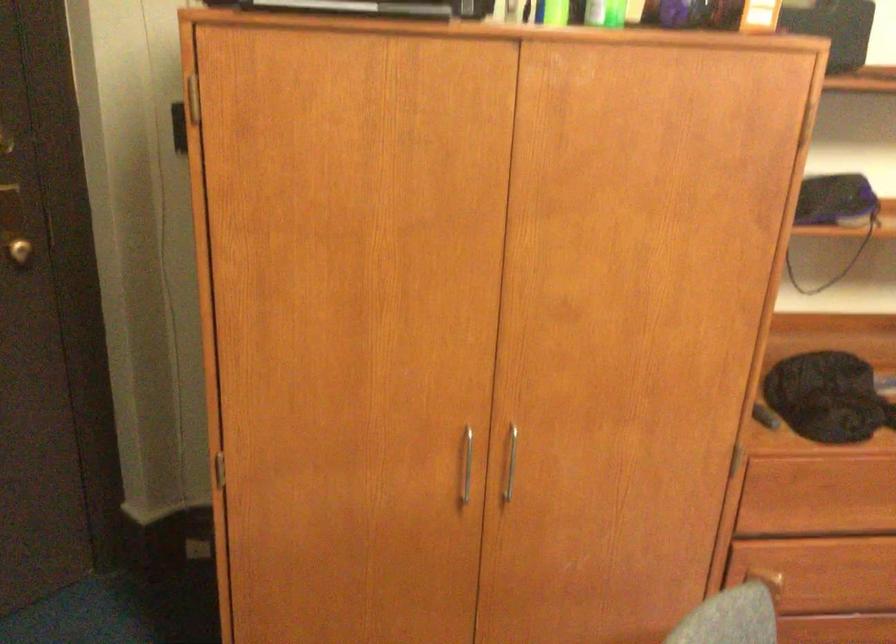
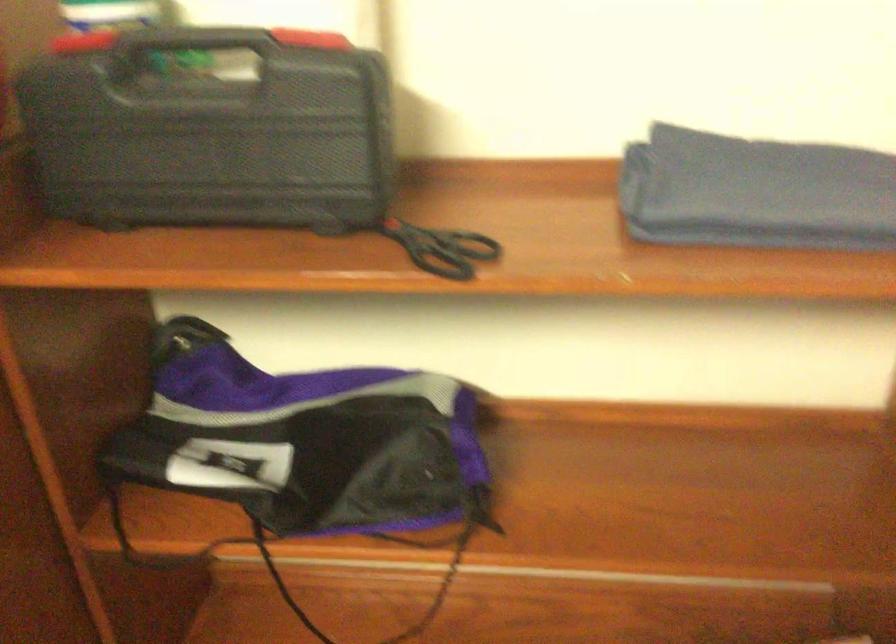
In a continuous first-person perspective shot, in which direction is the camera moving?

The cameraman moved toward right, forward.